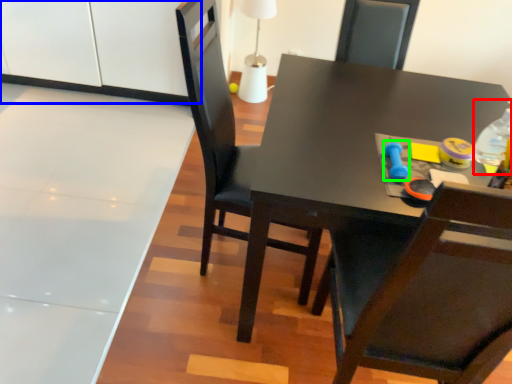
Question: Which is farther away from bottle (highlighted by a red box)? cabinetry (highlighted by a blue box) or toy (highlighted by a green box)?

Choices:
 (A) cabinetry
 (B) toy

Answer: (A)